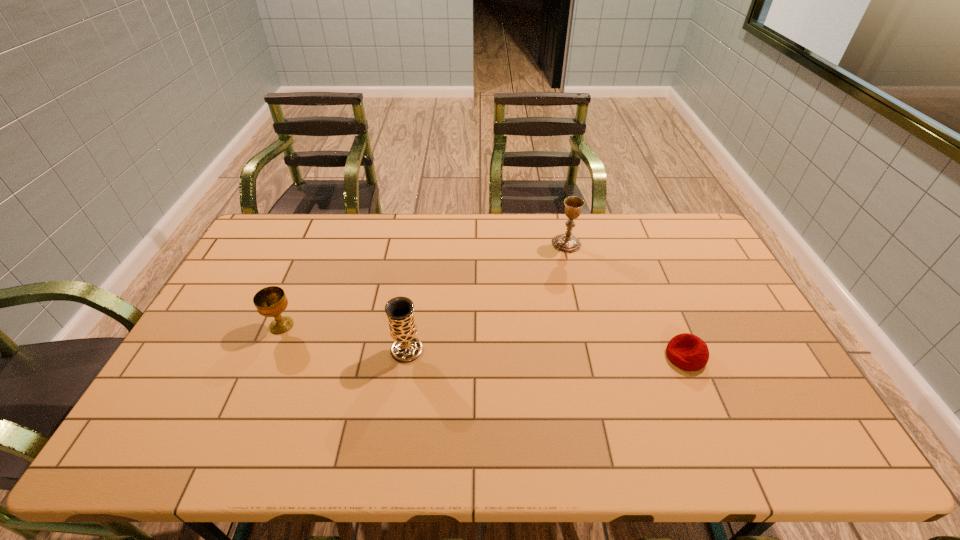
The height and width of the screenshot is (540, 960). Find the location of `the rightmost chalice`. the rightmost chalice is located at coordinates (567, 243).

Locate an element on the screen. The height and width of the screenshot is (540, 960). the farthest object is located at coordinates (x=567, y=243).

I want to click on the nearest chalice, so click(x=400, y=310).

Identify the location of the third object from right to left. The image size is (960, 540). (400, 310).

What are the coordinates of `the leftmost chalice` in the screenshot? It's located at (271, 301).

Where is `the second farthest chalice`? Image resolution: width=960 pixels, height=540 pixels. the second farthest chalice is located at coordinates (271, 301).

This screenshot has width=960, height=540. I want to click on the rightmost object, so click(686, 351).

Locate an element on the screen. the shortest object is located at coordinates (686, 351).

Locate an element on the screen. vacant space located on the left of the farthest chalice is located at coordinates (521, 244).

Locate an element on the screen. This screenshot has height=540, width=960. vacant area located on the right of the second chalice from left to right is located at coordinates coord(540,350).